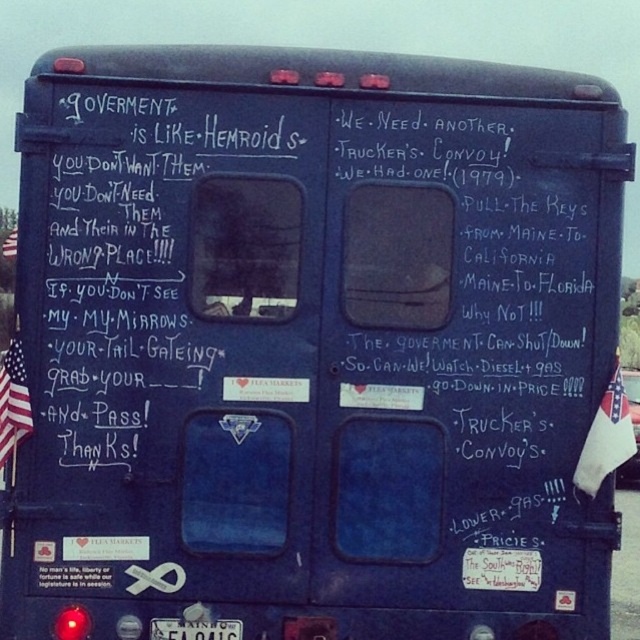
Which is in front, point (12, 364) or point (163, 628)?

Point (12, 364)

This screenshot has width=640, height=640. I want to click on american flag at left, so click(13, 401).

Is american flag fabric at right bigger than american flag at left?

Correct, american flag fabric at right is larger in size than american flag at left.

Is point (582, 445) positioned in front of point (4, 401)?

That is False.

Which is in front, point (627, 413) or point (20, 406)?

Positioned in front is point (20, 406).

This screenshot has width=640, height=640. Find the location of `american flag fabric at right`. american flag fabric at right is located at coordinates (605, 436).

Can you confirm if american flag fabric at right is taller than white plastic license plate at lower center?

Indeed, american flag fabric at right has a greater height compared to white plastic license plate at lower center.

Where is `american flag fabric at right`? The width and height of the screenshot is (640, 640). american flag fabric at right is located at coordinates (605, 436).